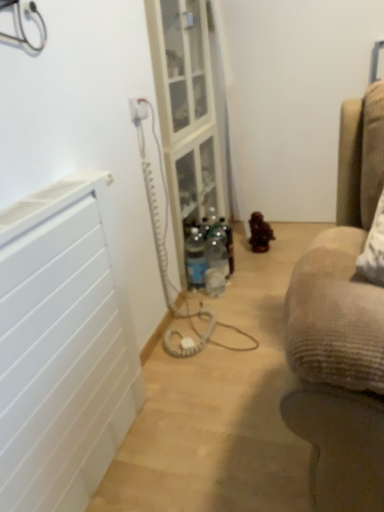
This screenshot has width=384, height=512. Find the location of `free area in between clear plastic bottle at center and white matte radiator at left`. free area in between clear plastic bottle at center and white matte radiator at left is located at coordinates (185, 327).